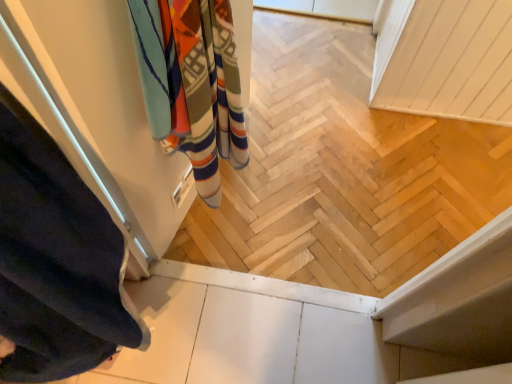
Identify the location of vacant space underneath multicolored woven towel at upper left (from a real-world perspective). The width and height of the screenshot is (512, 384). (216, 224).